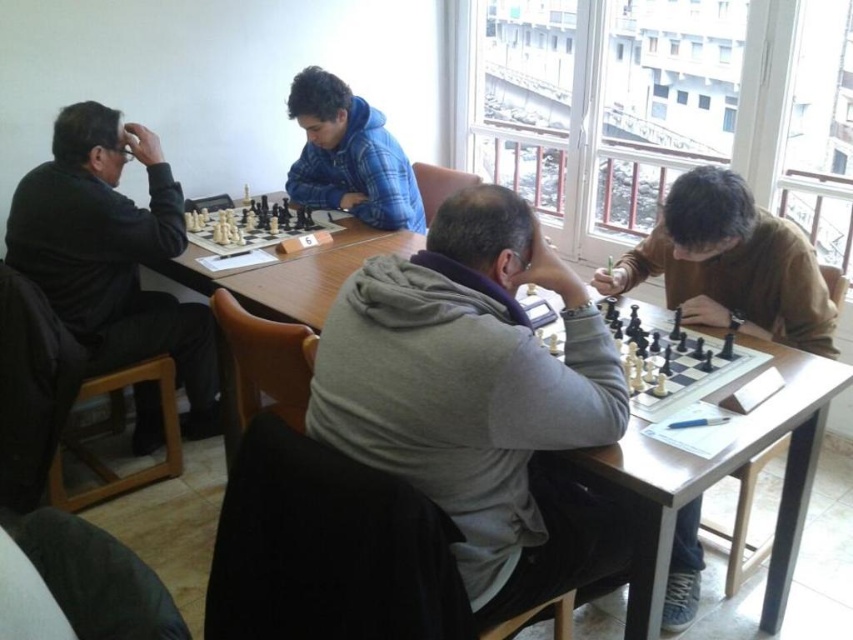
Is brown cotton shirt at center bigger than blue plaid hoodie at center?

Yes, brown cotton shirt at center is bigger than blue plaid hoodie at center.

Who is lower down, brown cotton shirt at center or blue plaid hoodie at center?

Positioned lower is brown cotton shirt at center.

What do you see at coordinates (730, 264) in the screenshot? I see `brown cotton shirt at center` at bounding box center [730, 264].

Locate an element on the screen. The width and height of the screenshot is (853, 640). brown cotton shirt at center is located at coordinates (730, 264).

Which is above, blue plaid hoodie at center or black plastic chess set at center?

blue plaid hoodie at center

Can you confirm if blue plaid hoodie at center is positioned to the right of black plastic chess set at center?

Yes, blue plaid hoodie at center is to the right of black plastic chess set at center.

This screenshot has width=853, height=640. Describe the element at coordinates (347, 156) in the screenshot. I see `blue plaid hoodie at center` at that location.

Where is `blue plaid hoodie at center`? blue plaid hoodie at center is located at coordinates (347, 156).

Does black matte jacket at left have a greater width compared to white plastic chess set at lower right?

Yes.

Is black matte jacket at left smaller than white plastic chess set at lower right?

No.

I want to click on black matte jacket at left, so click(x=112, y=253).

What are the coordinates of `black matte jacket at left` in the screenshot? It's located at (112, 253).